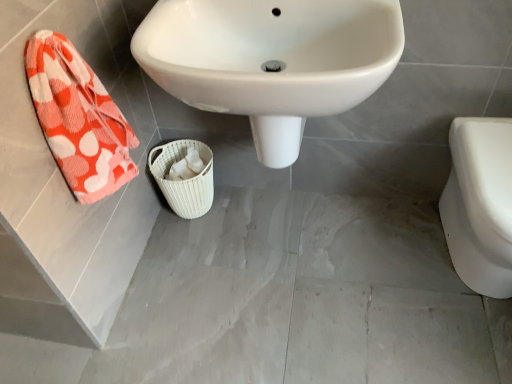
Question: In the image, is white glossy sink at center positioned in front of or behind white woven basket at center?

Choices:
 (A) front
 (B) behind

Answer: (A)

Question: Is point (203, 0) closer or farther from the camera than point (203, 152)?

Choices:
 (A) farther
 (B) closer

Answer: (B)

Question: Based on their relative distances, which object is farther from the white glossy toilet at right?

Choices:
 (A) orange-patterned towel at left
 (B) white glossy sink at center
 (C) white woven basket at center

Answer: (A)

Question: Which object is the farthest from the orange-patterned towel at left?

Choices:
 (A) white woven basket at center
 (B) white glossy toilet at right
 (C) white glossy sink at center

Answer: (B)